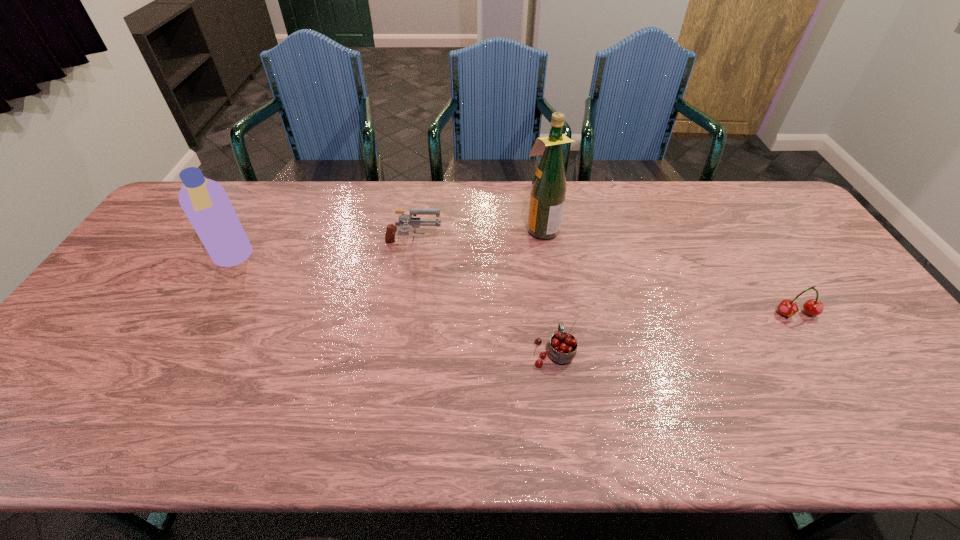
Where is `liquor`? This screenshot has height=540, width=960. liquor is located at coordinates (548, 190).

At what (x,y) coordinates should I click in order to perform the action: click on the leftmost object. Please return your answer as a coordinate pair (x, y). Looking at the image, I should click on click(205, 202).

You are a GUI agent. You are given a task and a screenshot of the screen. Output one action in this format:
    pyautogui.click(x=<x>, y=<y>)
    Task: Click on the shampoo
    The height and width of the screenshot is (540, 960).
    Given the screenshot: What is the action you would take?
    pyautogui.click(x=205, y=202)

Find the location of a particular element. This screenshot has height=540, width=960. the third tallest object is located at coordinates (403, 218).

This screenshot has width=960, height=540. In order to click on the fourth object from right to left in this screenshot , I will do `click(403, 218)`.

Find the location of `the second nearest object`. the second nearest object is located at coordinates (814, 307).

Locate an element on the screen. Image resolution: width=960 pixels, height=540 pixels. the farther cherry is located at coordinates (814, 307).

Find the location of a particular element. This screenshot has width=960, height=540. the nearer cherry is located at coordinates (562, 348).

Find the location of `the left cherry`. the left cherry is located at coordinates (562, 348).

This screenshot has width=960, height=540. I want to click on free region located on the front-facing side of the liquor, so click(502, 228).